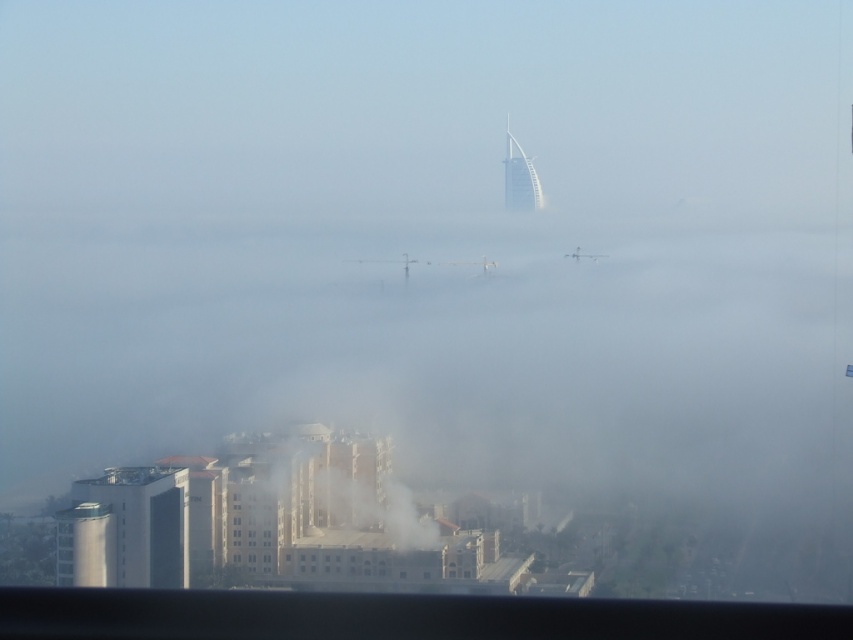
You are standing at point (392, 492) and want to reach the Burj Al Arab hotel in Dubai. The distance between you and the hotel is 652.32 meters. If you walk at a speed of 1.5 meters per second, how many minutes will it take you to reach the hotel?

The distance between you and the Burj Al Arab hotel is 652.32 meters. At a walking speed of 1.5 meters per second, it will take 652.32 divided by 1.5 equals approximately 434.88 seconds. Converting seconds to minutes by dividing by 60 gives about 7.25 minutes. So, it will take approximately 7.25 minutes to reach the hotel.

You are a city planner assessing the visibility of landmarks in this foggy area. Given the presence of the white smoke at center and the white glass tower at upper center, which one would be more prominently visible from a distance due to its height?

The white glass tower at upper center would be more prominently visible from a distance because it has a greater height than the white smoke at center.